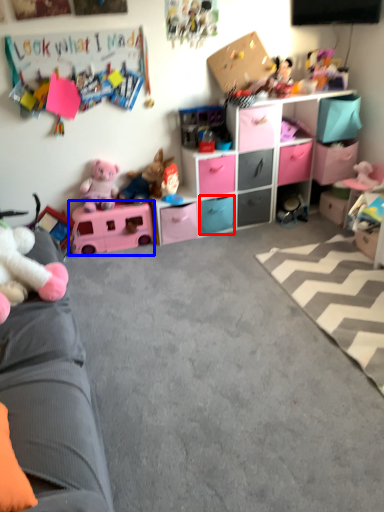
Question: Which point is further to the camera, drawer (highlighted by a red box) or toy (highlighted by a blue box)?

Choices:
 (A) drawer
 (B) toy

Answer: (A)